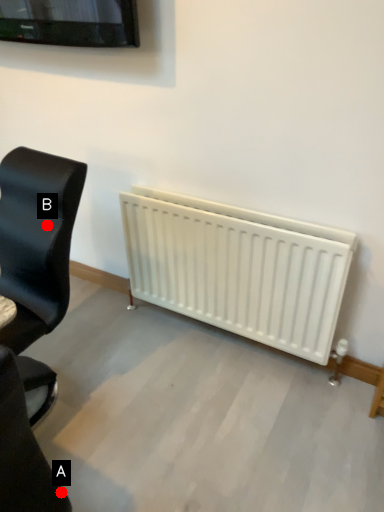
Question: Two points are circled on the image, labeled by A and B beside each circle. Which point is closer to the camera?

Choices:
 (A) A is closer
 (B) B is closer

Answer: (A)